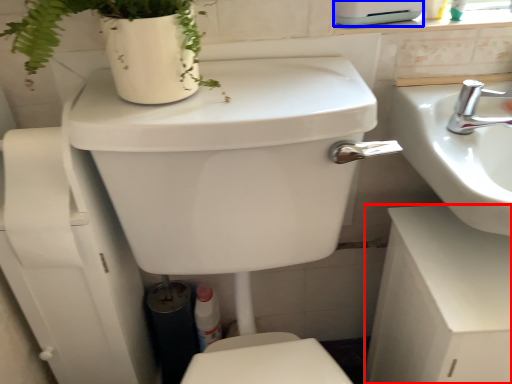
Question: Which point is closer to the camera, counter top (highlighted by a red box) or appliance (highlighted by a blue box)?

Choices:
 (A) counter top
 (B) appliance

Answer: (A)